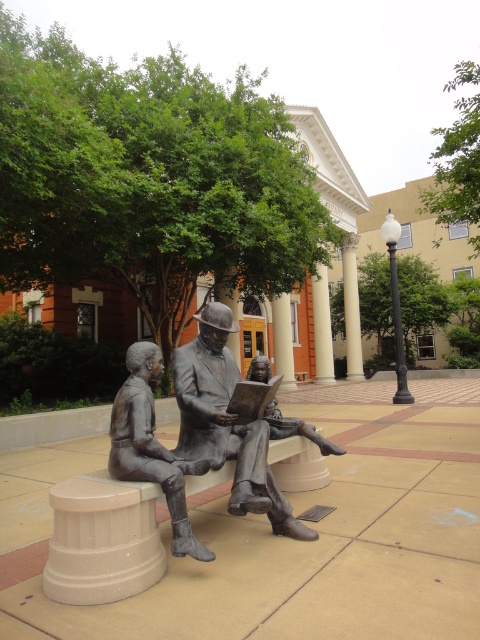
Question: Which point is farther from the camera taking this photo?

Choices:
 (A) (190, 451)
 (B) (206, 561)

Answer: (A)

Question: From the image, what is the correct spatial relationship of bronze statue of man reading at center in relation to bronze statue of man reading book at center?

Choices:
 (A) left
 (B) right

Answer: (B)

Question: Is bronze statue of man reading at center behind bronze statue of man reading book at center?

Choices:
 (A) yes
 (B) no

Answer: (A)

Question: Is bronze statue of man reading at center above bronze statue of man reading book at center?

Choices:
 (A) yes
 (B) no

Answer: (A)

Question: Among these objects, which one is farthest from the camera?

Choices:
 (A) bronze statue of man reading book at center
 (B) bronze statue of man reading at center

Answer: (B)